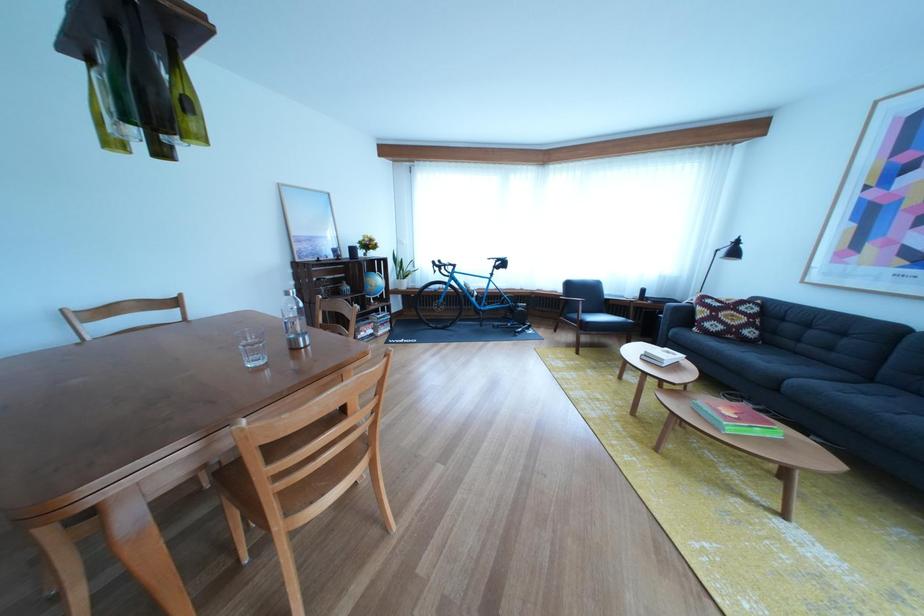
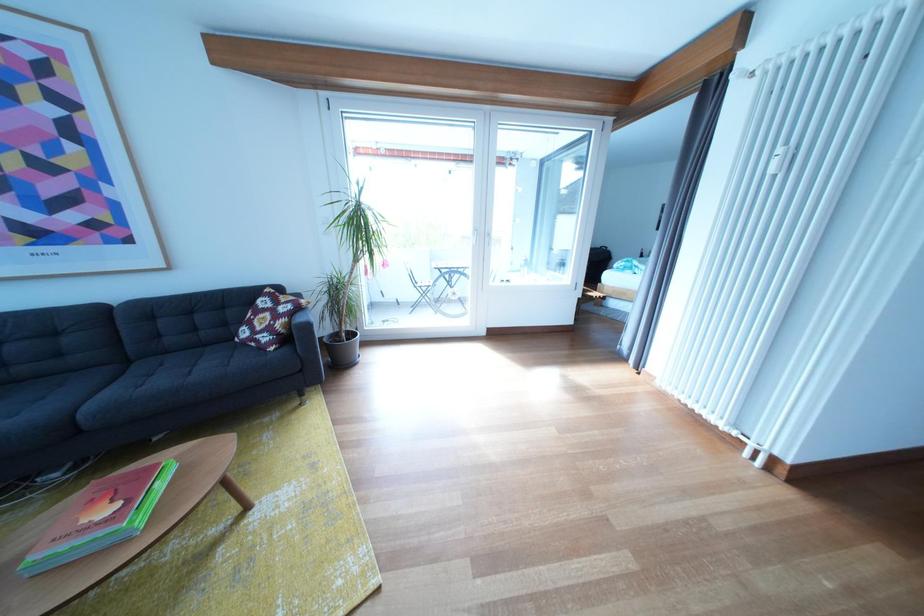
Locate, in the second image, the point that corresponds to (883,387) in the first image.

(141, 368)